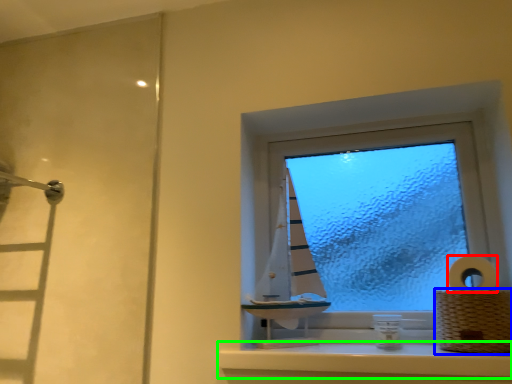
Question: Which object is the farthest from toilet paper (highlighted by a red box)? Choose among these: basket (highlighted by a blue box) or window sill (highlighted by a green box).

Choices:
 (A) basket
 (B) window sill

Answer: (B)